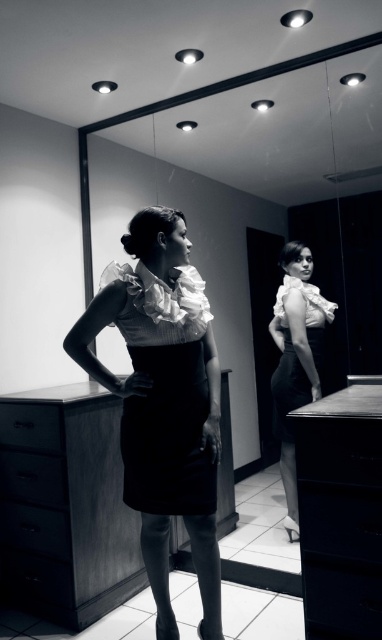
Question: Is black satin dress at center to the right of matte black drawer at lower left from the viewer's perspective?

Choices:
 (A) yes
 (B) no

Answer: (A)

Question: Among these objects, which one is farthest from the camera?

Choices:
 (A) black satin dress at center
 (B) black matte drawer at lower left
 (C) black glossy dresser at lower right
 (D) matte wood drawer at lower left

Answer: (D)

Question: Which object appears farthest from the camera in this image?

Choices:
 (A) black matte drawer at lower left
 (B) white ruffled blouse at center
 (C) black glossy dresser at lower right

Answer: (B)

Question: Which object is the farthest from the white ruffled blouse at center?

Choices:
 (A) matte black drawer at lower left
 (B) black glossy dresser at lower right
 (C) matte wood drawer at lower left
 (D) black glossy drawer at lower left

Answer: (C)

Question: Is the position of black satin dress at center more distant than that of white ruffled blouse at center?

Choices:
 (A) no
 (B) yes

Answer: (A)

Question: Is dark wood dresser at center above matte wood drawer at lower left?

Choices:
 (A) no
 (B) yes

Answer: (B)